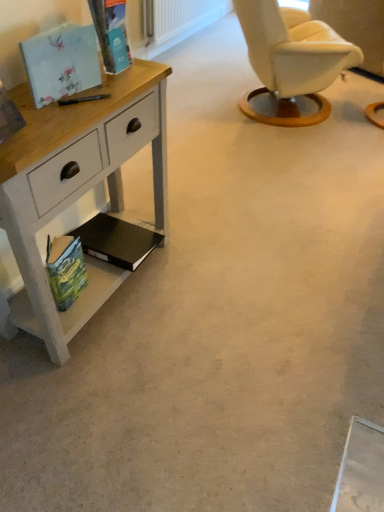
Where is `free space in front of white painted wood desk at left`? free space in front of white painted wood desk at left is located at coordinates (102, 397).